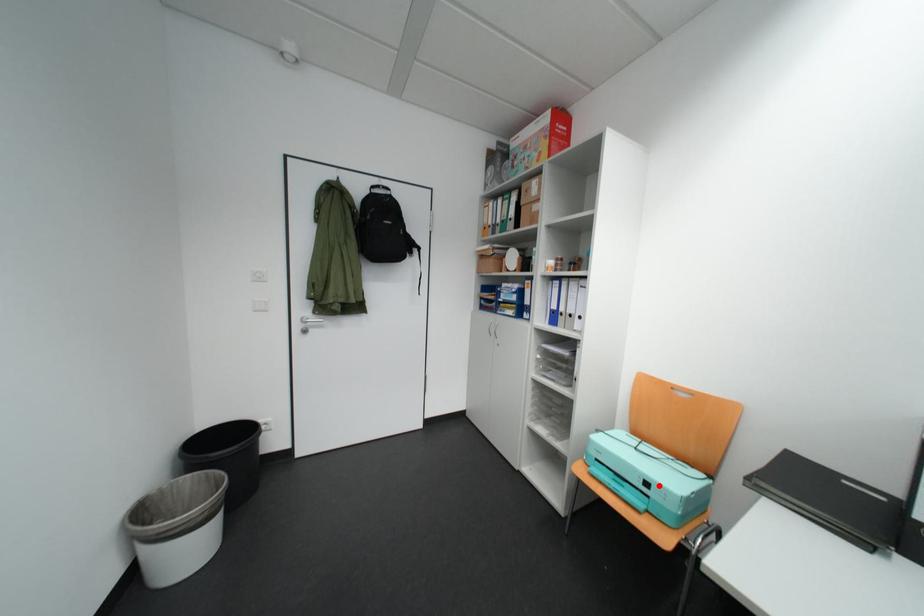
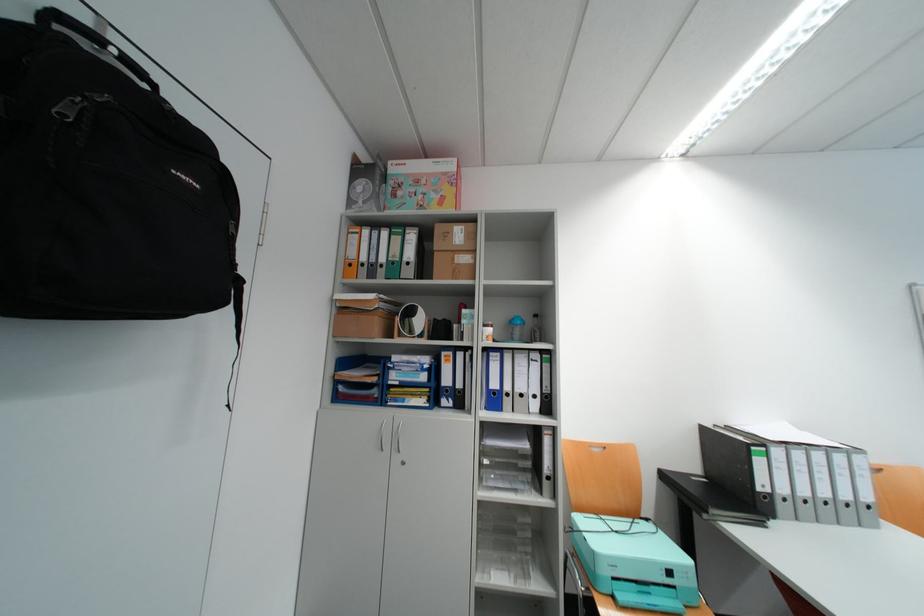
Question: A red point is marked in image1. In image2, is the corresponding 3D point closer to the camera or farther? Reply with the corresponding letter.

Choices:
 (A) The corresponding 3D point is closer.
 (B) The corresponding 3D point is farther.

Answer: (A)